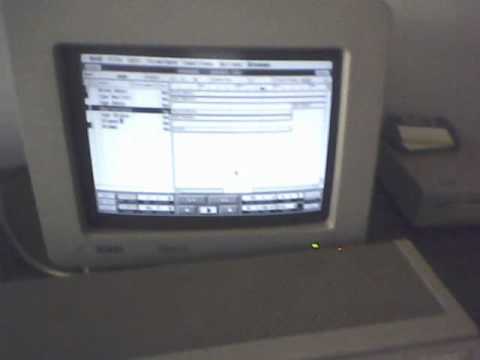
The height and width of the screenshot is (360, 480). Find the location of `left center edge of monitor`. left center edge of monitor is located at coordinates (46, 141).